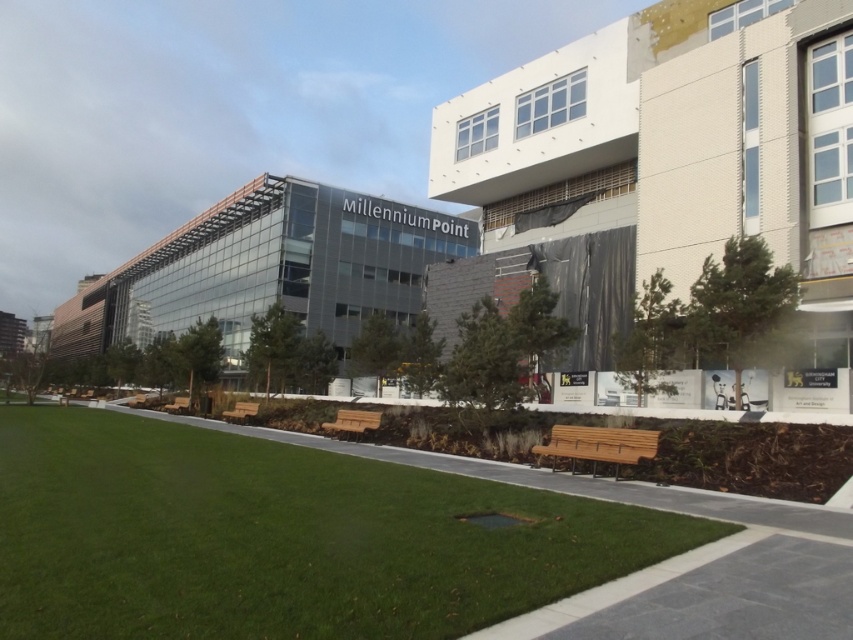
Question: Which point is closer to the camera taking this photo?

Choices:
 (A) (184, 412)
 (B) (241, 417)

Answer: (B)

Question: Can you confirm if green grass at center is wider than wooden bench at lower left?

Choices:
 (A) no
 (B) yes

Answer: (B)

Question: Is wooden park bench at center positioned in front of wooden bench at center?

Choices:
 (A) yes
 (B) no

Answer: (A)

Question: Among these points, which one is nearest to the camera?

Choices:
 (A) (370, 424)
 (B) (242, 406)
 (C) (183, 404)

Answer: (A)

Question: Considering the relative positions of green grass at center and wooden bench at lower left in the image provided, where is green grass at center located with respect to wooden bench at lower left?

Choices:
 (A) below
 (B) above

Answer: (B)

Question: Which object is the closest to the wooden bench at lower left?

Choices:
 (A) wooden bench at center
 (B) wooden park bench at center
 (C) green grass at center
 (D) wooden bench at lower right

Answer: (A)